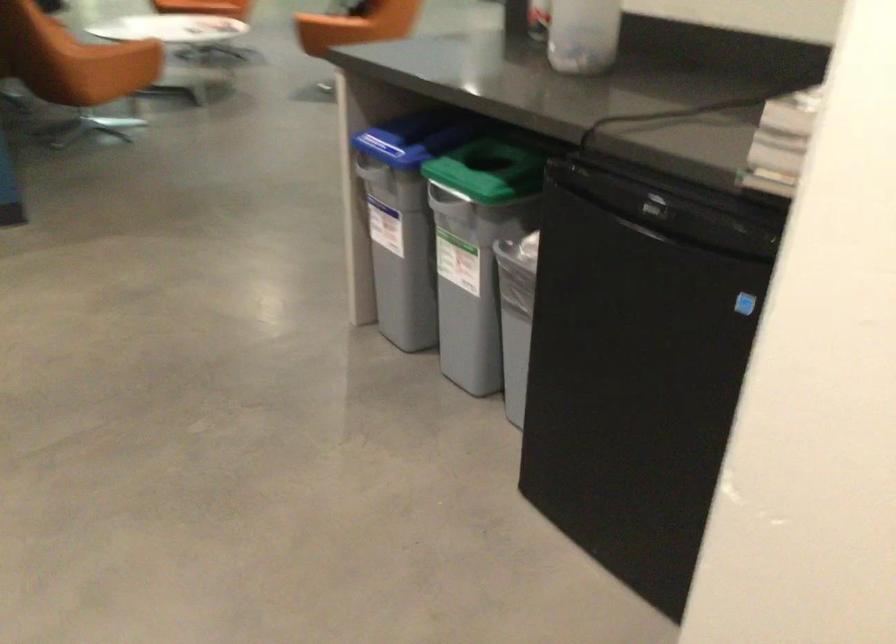
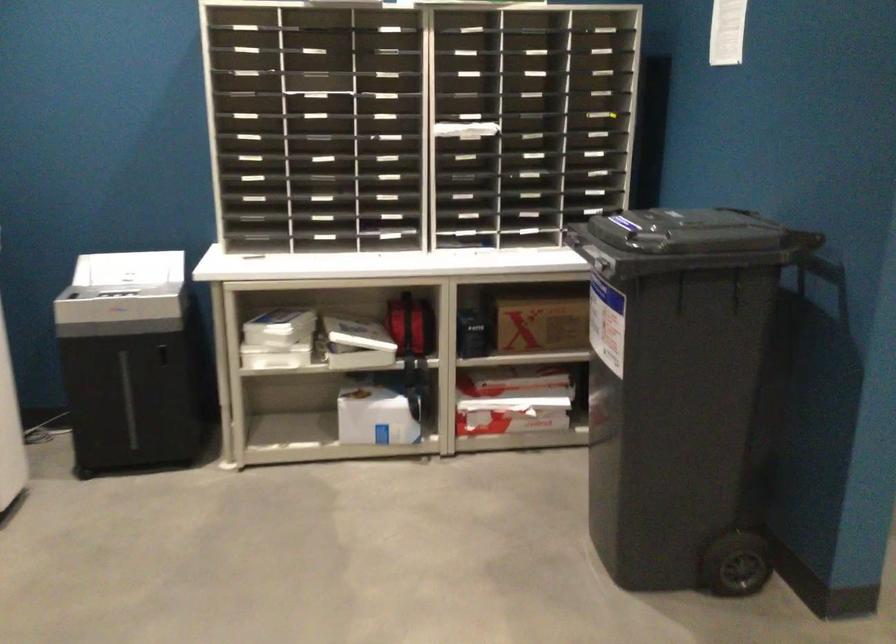
Which direction would the cameraman need to move to produce the second image?

The movement direction of the cameraman is left, forward.